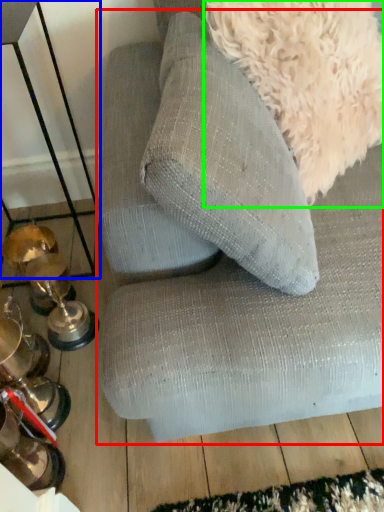
Question: Based on their relative distances, which object is farther from studio couch (highlighted by a red box)? Choose from table (highlighted by a blue box) and dog (highlighted by a green box).

Choices:
 (A) table
 (B) dog

Answer: (A)